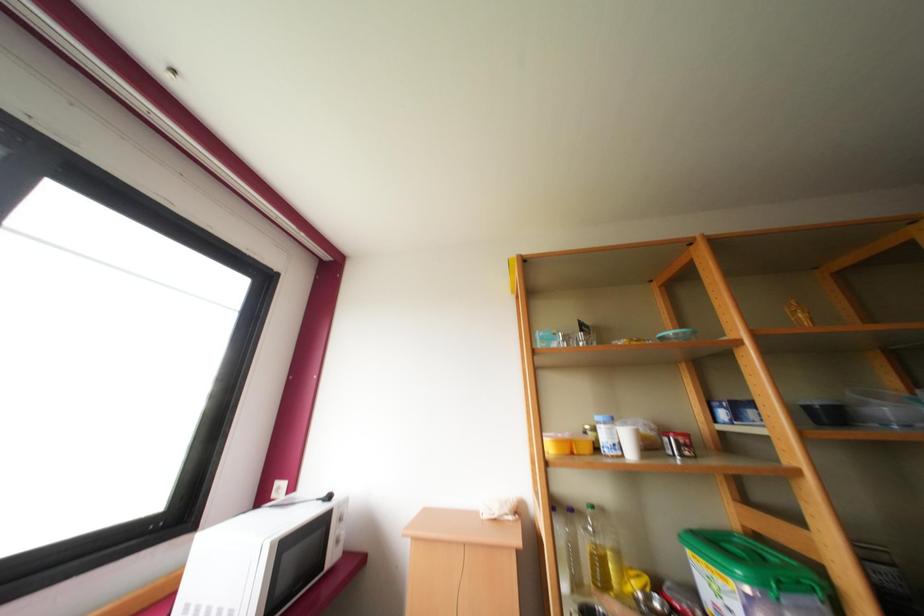
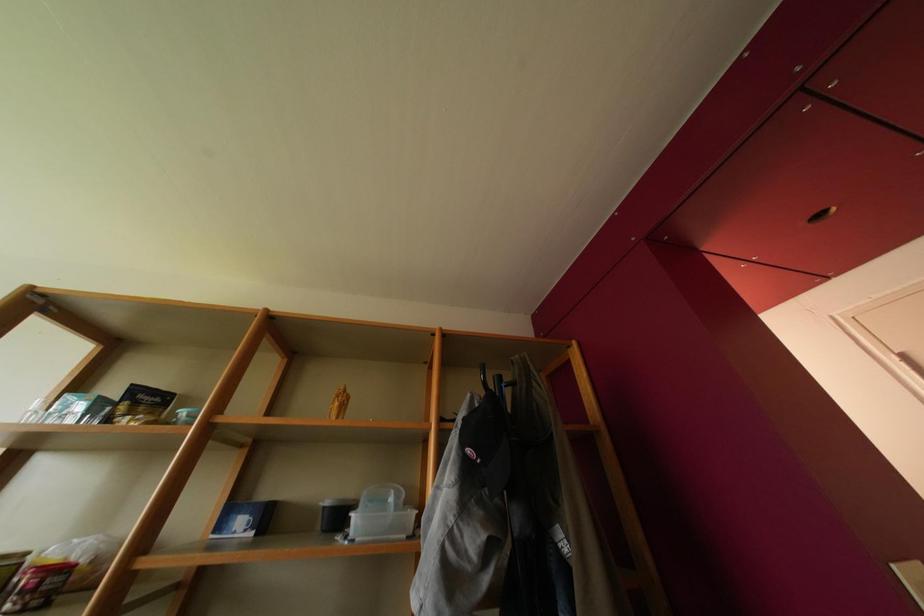
Question: The images are taken continuously from a first-person perspective. In which direction are you moving?

Choices:
 (A) Left
 (B) Right
 (C) Forward
 (D) Backward

Answer: (B)